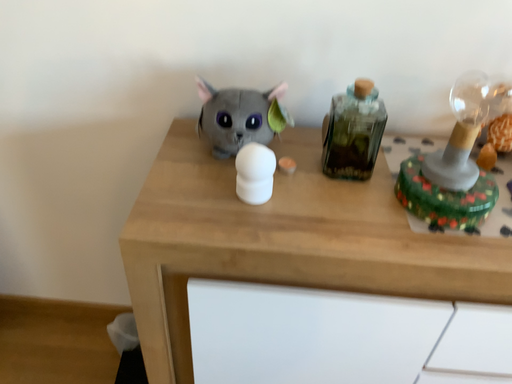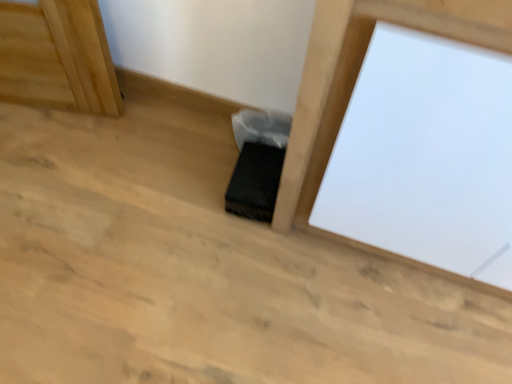
Question: Which way did the camera rotate in the video?

Choices:
 (A) rotated right
 (B) rotated left

Answer: (B)